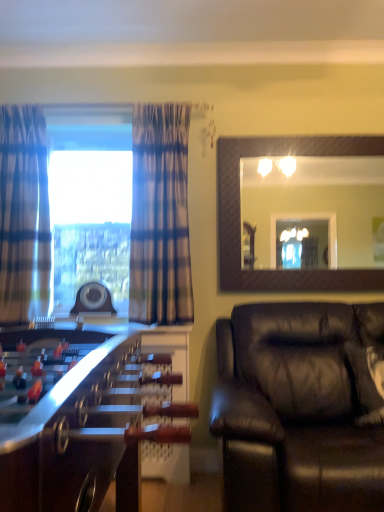
Question: Does plaid fabric curtain at left, acting as the 1th curtain starting from the left, have a larger size compared to plaid fabric curtain at left, which is the 2th curtain from left to right?

Choices:
 (A) yes
 (B) no

Answer: (B)

Question: Is plaid fabric curtain at left, arranged as the second curtain when viewed from the right, beside plaid fabric curtain at left, which is the 2th curtain from left to right?

Choices:
 (A) no
 (B) yes

Answer: (A)

Question: Would you say plaid fabric curtain at left, acting as the 1th curtain starting from the left, is outside plaid fabric curtain at left, which is the 2th curtain from left to right?

Choices:
 (A) yes
 (B) no

Answer: (A)

Question: Considering the relative positions of plaid fabric curtain at left, acting as the 1th curtain starting from the left, and plaid fabric curtain at left, which is the 2th curtain from left to right, in the image provided, is plaid fabric curtain at left, acting as the 1th curtain starting from the left, in front of plaid fabric curtain at left, which is the 2th curtain from left to right,?

Choices:
 (A) yes
 (B) no

Answer: (A)

Question: Can you confirm if plaid fabric curtain at left, arranged as the second curtain when viewed from the right, is smaller than plaid fabric curtain at left, which is the 2th curtain from left to right?

Choices:
 (A) no
 (B) yes

Answer: (B)

Question: From the image's perspective, is plaid fabric curtain at left, acting as the 1th curtain starting from the left, under plaid fabric curtain at left, which is the 2th curtain from left to right?

Choices:
 (A) no
 (B) yes

Answer: (A)

Question: From the image's perspective, is wooden foosball table at left below black leather couch at lower right?

Choices:
 (A) yes
 (B) no

Answer: (A)

Question: Is wooden foosball table at left located outside black leather couch at lower right?

Choices:
 (A) yes
 (B) no

Answer: (A)

Question: Does wooden foosball table at left have a greater width compared to black leather couch at lower right?

Choices:
 (A) yes
 (B) no

Answer: (B)

Question: Is wooden foosball table at left beside black leather couch at lower right?

Choices:
 (A) yes
 (B) no

Answer: (B)

Question: Considering the relative sizes of wooden foosball table at left and black leather couch at lower right in the image provided, is wooden foosball table at left thinner than black leather couch at lower right?

Choices:
 (A) yes
 (B) no

Answer: (A)

Question: Is there a large distance between wooden foosball table at left and black leather couch at lower right?

Choices:
 (A) no
 (B) yes

Answer: (A)

Question: Does matte brown mirror at upper right have a greater height compared to plaid fabric curtain at left, arranged as the second curtain when viewed from the right?

Choices:
 (A) no
 (B) yes

Answer: (A)